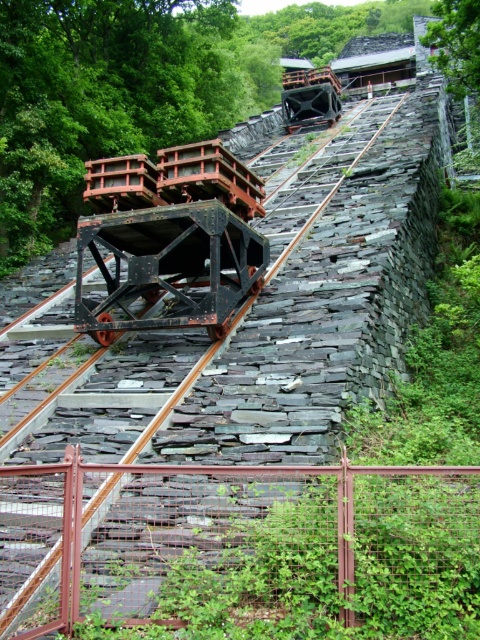
You are a worker at the slate mining site. You need to determine the safest path to avoid the rusty metal rail at center and the rusty metal train track at center. Which object is closer to you, and should you move around it first?

Answer: The rusty metal rail at center is in front of the rusty metal train track at center, so the rail is closer to you. You should move around the rusty metal rail at center first to ensure safety.

You are standing at the bottom of the incline and want to reach the top. There is a rusty metal rail at center. Which direction should you face to grab the rail?

You should face upward along the incline to grab the rusty metal rail at center located at point (240,545).